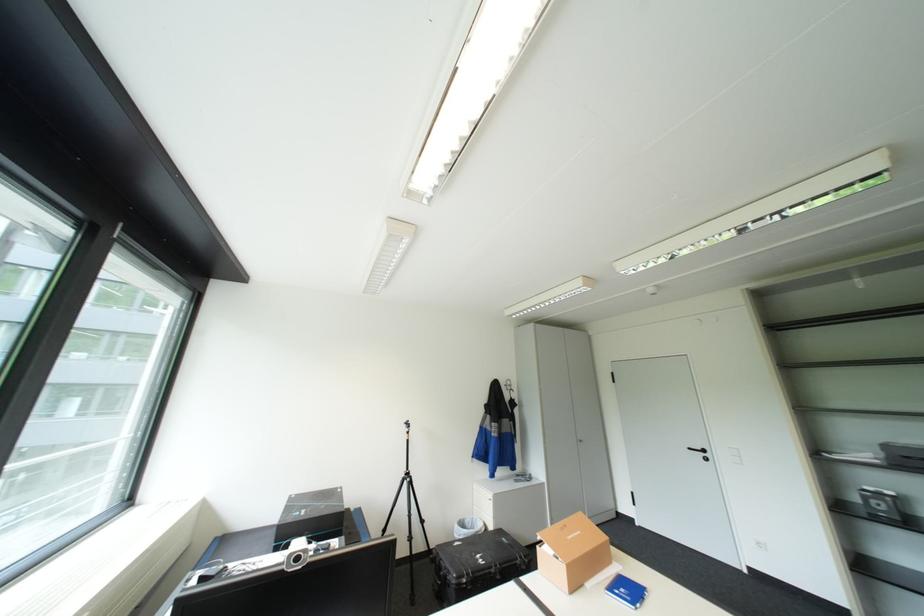
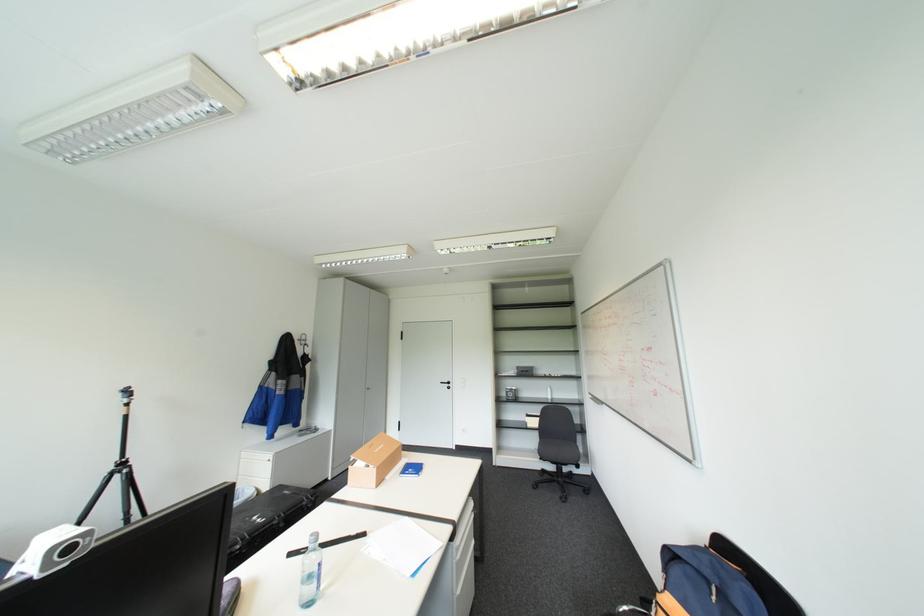
Question: Based on the continuous images, in which direction is the camera rotating? Reply with the corresponding letter.

Choices:
 (A) Left
 (B) Right
 (C) Up
 (D) Down

Answer: (B)